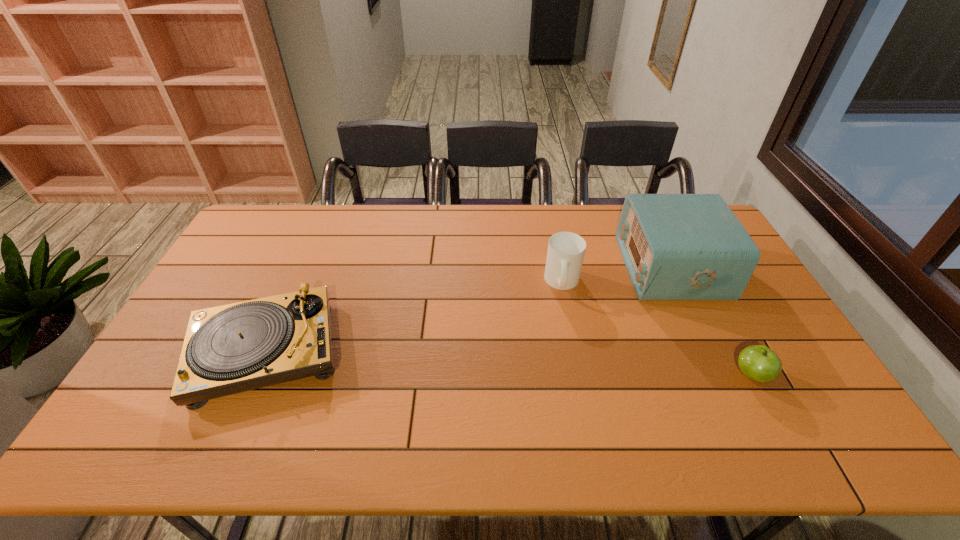
Locate an element on the screen. blank area located on the left of the apple is located at coordinates (707, 375).

Identify the location of object present at the far edge. The image size is (960, 540). (675, 246).

Identify the location of object that is at the left edge. (229, 349).

The width and height of the screenshot is (960, 540). Find the location of `radio receiver positioned at the right edge`. radio receiver positioned at the right edge is located at coordinates (675, 246).

Where is `apple located at the right edge`? This screenshot has height=540, width=960. apple located at the right edge is located at coordinates (759, 363).

Where is `object located in the far right corner section of the desktop`? object located in the far right corner section of the desktop is located at coordinates (675, 246).

Identify the location of free space at the far edge of the desktop. The image size is (960, 540). (567, 218).

Locate an element on the screen. This screenshot has width=960, height=540. vacant space at the right edge is located at coordinates (795, 374).

This screenshot has height=540, width=960. Identify the location of vacant space at the far left corner of the desktop. (255, 232).

Where is `free location at the near right corner`? Image resolution: width=960 pixels, height=540 pixels. free location at the near right corner is located at coordinates pos(852,454).